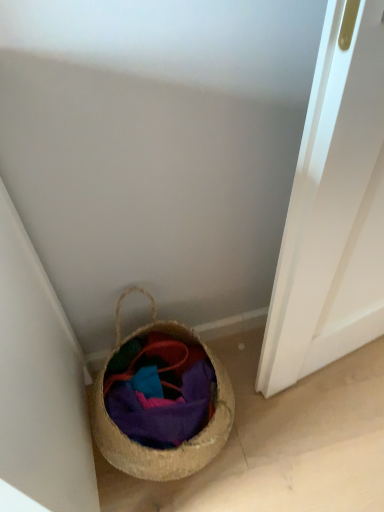
Question: Is multicolored woven basket at lower left oriented towards woven straw basket at lower left?

Choices:
 (A) yes
 (B) no

Answer: (A)

Question: From a real-world perspective, is multicolored woven basket at lower left located beneath woven straw basket at lower left?

Choices:
 (A) yes
 (B) no

Answer: (A)

Question: Is multicolored woven basket at lower left positioned with its back to woven straw basket at lower left?

Choices:
 (A) yes
 (B) no

Answer: (A)

Question: Are multicolored woven basket at lower left and woven straw basket at lower left far apart?

Choices:
 (A) no
 (B) yes

Answer: (A)

Question: Is multicolored woven basket at lower left wider than woven straw basket at lower left?

Choices:
 (A) no
 (B) yes

Answer: (A)

Question: Is the position of multicolored woven basket at lower left more distant than that of woven straw basket at lower left?

Choices:
 (A) yes
 (B) no

Answer: (A)

Question: Is woven straw basket at lower left in front of multicolored woven basket at lower left?

Choices:
 (A) no
 (B) yes

Answer: (B)

Question: Is woven straw basket at lower left to the left of multicolored woven basket at lower left from the viewer's perspective?

Choices:
 (A) yes
 (B) no

Answer: (A)

Question: Is the depth of woven straw basket at lower left greater than that of multicolored woven basket at lower left?

Choices:
 (A) yes
 (B) no

Answer: (B)

Question: From a real-world perspective, is woven straw basket at lower left on top of multicolored woven basket at lower left?

Choices:
 (A) yes
 (B) no

Answer: (A)

Question: Are woven straw basket at lower left and multicolored woven basket at lower left beside each other?

Choices:
 (A) yes
 (B) no

Answer: (A)

Question: Is woven straw basket at lower left bigger than multicolored woven basket at lower left?

Choices:
 (A) yes
 (B) no

Answer: (A)

Question: Is woven straw basket at lower left inside the boundaries of multicolored woven basket at lower left, or outside?

Choices:
 (A) outside
 (B) inside

Answer: (A)